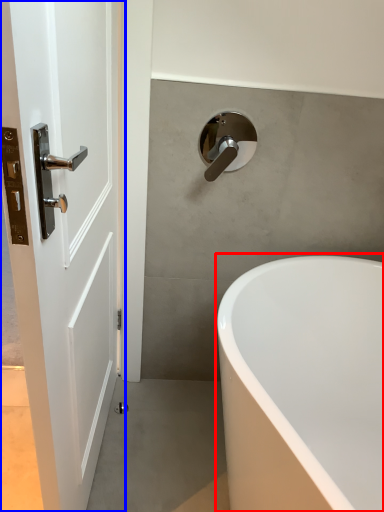
Question: Which point is further to the camera, bathtub (highlighted by a red box) or door (highlighted by a blue box)?

Choices:
 (A) bathtub
 (B) door

Answer: (A)